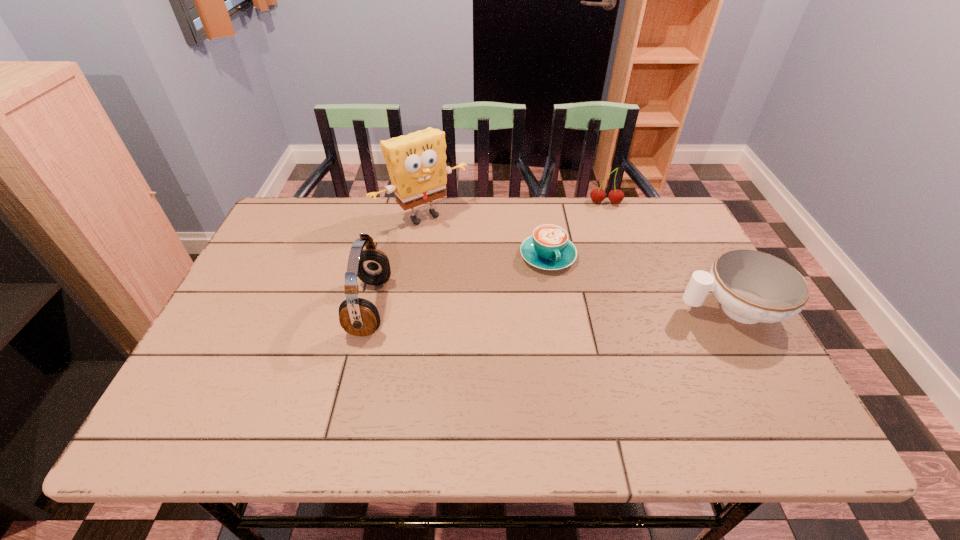
Where is `vacant space on the desktop that is between the second tallest object and the rightmost object and is positioned on the face of the tallest object`? This screenshot has width=960, height=540. vacant space on the desktop that is between the second tallest object and the rightmost object and is positioned on the face of the tallest object is located at coordinates (509, 308).

Identify the location of vacant space on the desktop that is between the second tallest object and the chinaware and is positioned with the handle on the right side of the third nearest object. (572, 308).

Where is `free space on the desktop that is between the headset and the chinaware and is positioned on the surface of the cherry`? The width and height of the screenshot is (960, 540). free space on the desktop that is between the headset and the chinaware and is positioned on the surface of the cherry is located at coordinates (604, 308).